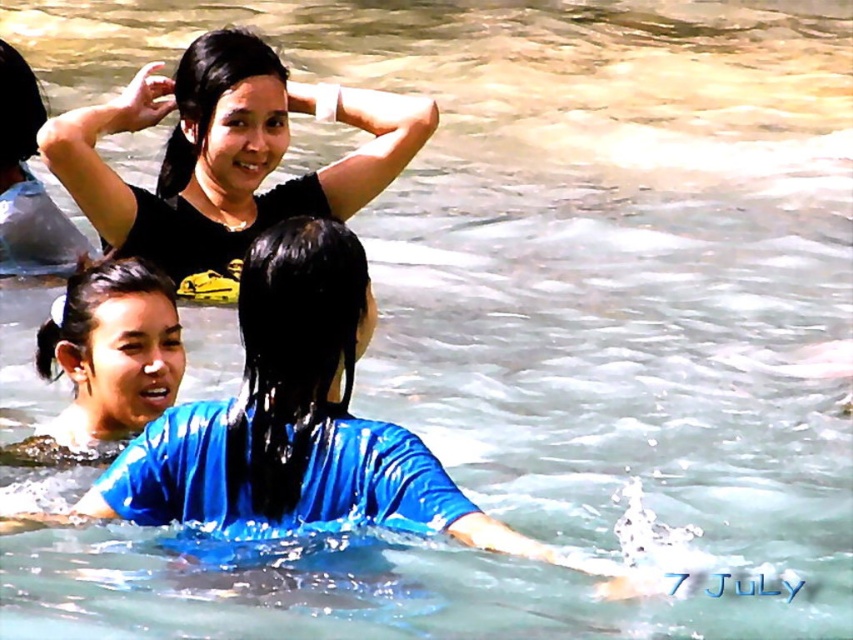
You are a photographer trying to capture a clear shot of the blue glossy shirt at center and the black matte shirt at upper center. Which shirt should you zoom in on to ensure it appears larger in your photo?

The black matte shirt at upper center is larger than the blue glossy shirt at center, so you should zoom in on the black matte shirt at upper center to ensure it appears larger in your photo.

You are standing at the origin point of the coordinate system and looking at the scene. There is a point marked at coordinates (x=289, y=420). Which object in the scene does this point correspond to?

The point at coordinates (x=289, y=420) corresponds to the blue glossy shirt at center.